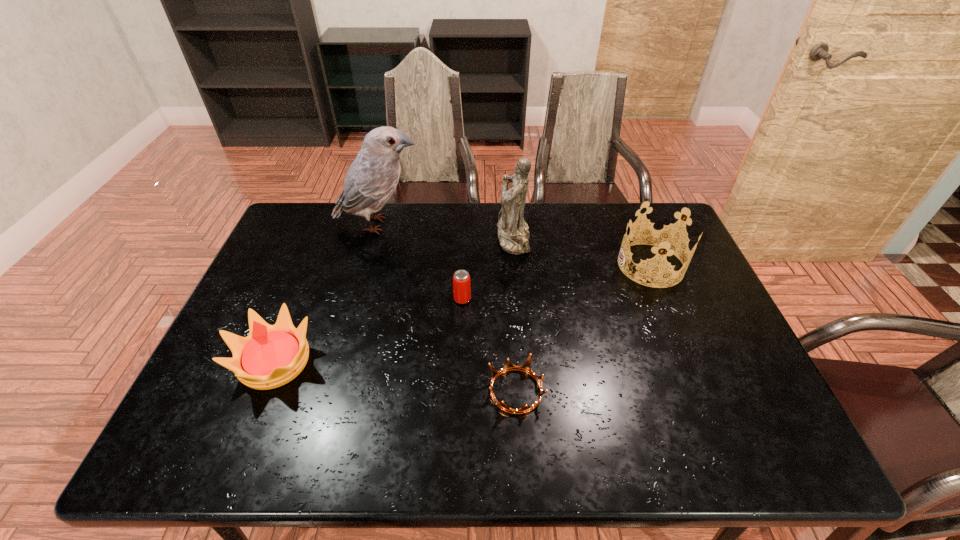
Find the location of a particular element. This screenshot has width=960, height=540. object positioned at the left edge is located at coordinates (270, 356).

This screenshot has height=540, width=960. What are the coordinates of `object that is at the right edge` in the screenshot? It's located at (660, 239).

This screenshot has height=540, width=960. In order to click on object located at the far right corner in this screenshot , I will do `click(660, 239)`.

The width and height of the screenshot is (960, 540). I want to click on vacant area at the far edge, so click(x=537, y=208).

Locate an element on the screen. The image size is (960, 540). free space at the near edge of the desktop is located at coordinates (365, 433).

I want to click on vacant space at the left edge of the desktop, so click(x=287, y=293).

Find the location of `free space at the right edge`. free space at the right edge is located at coordinates (674, 328).

You are a GUI agent. You are given a task and a screenshot of the screen. Output one action in this format:
    pyautogui.click(x=<x>, y=<y>)
    Task: Click on the vacant space at the far right corner
    The height and width of the screenshot is (540, 960).
    Given the screenshot: What is the action you would take?
    pyautogui.click(x=637, y=203)

The width and height of the screenshot is (960, 540). What are the coordinates of `free space between the figurine and the second crown from right to left` in the screenshot? It's located at (515, 314).

You are a GUI agent. You are given a task and a screenshot of the screen. Output one action in this format:
    pyautogui.click(x=<x>, y=<y>)
    Task: Click on the vacant space in between the tallest object and the leftmost crown
    This screenshot has width=960, height=540.
    Given the screenshot: What is the action you would take?
    pyautogui.click(x=327, y=293)